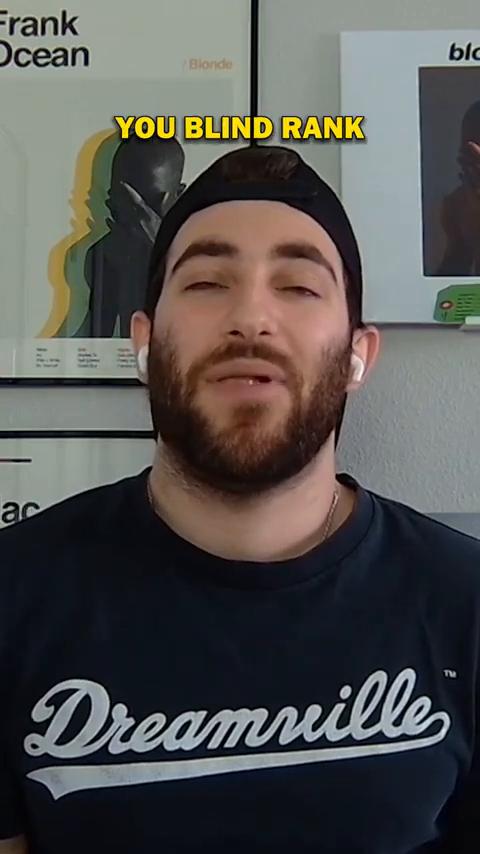
Find the location of a particular element. This screenshot has height=854, width=480. wall is located at coordinates (418, 393).